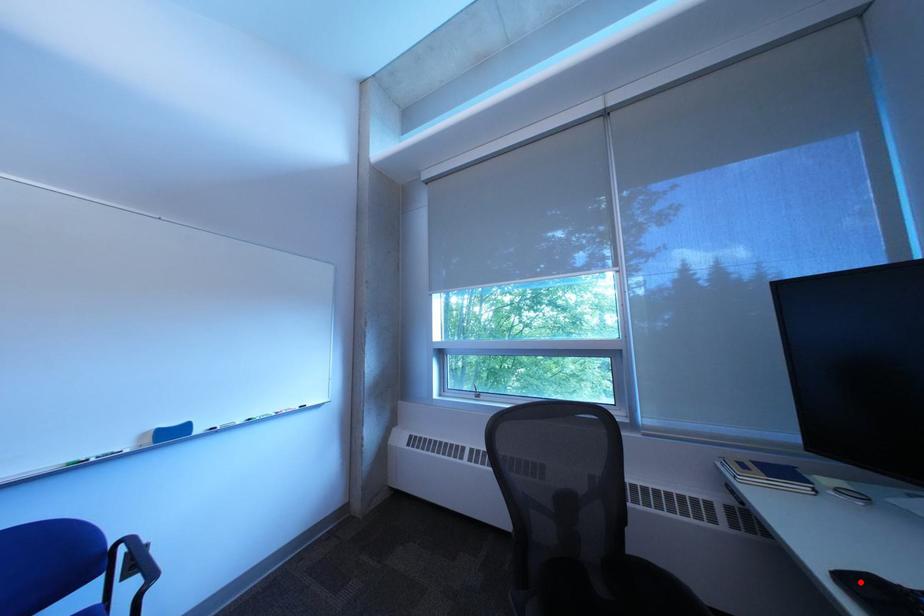
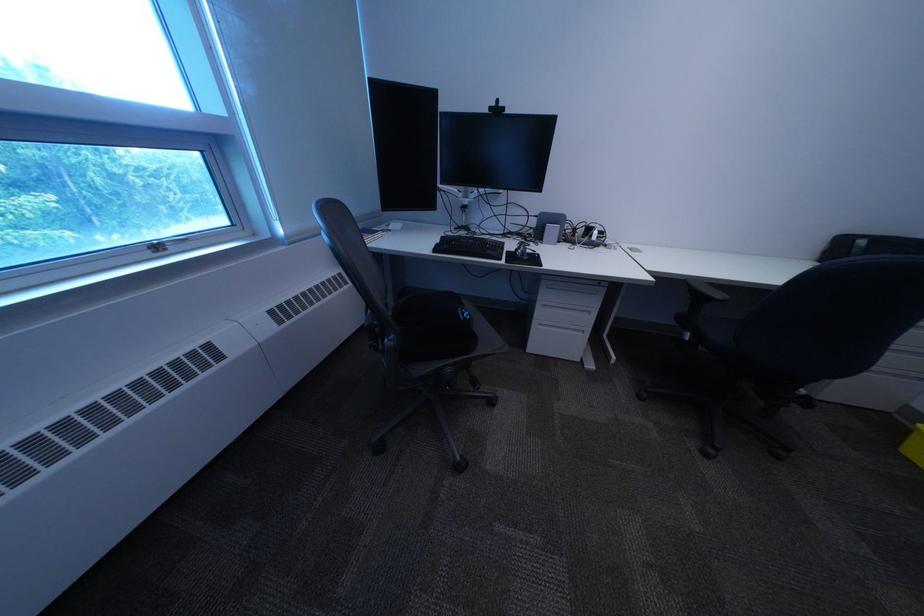
Question: I am providing you with two images of the same scene from different viewpoints. A red point is marked on the first image. At the location where the point appears in image 1, is it still visible in image 2?

Choices:
 (A) Yes
 (B) No

Answer: (A)